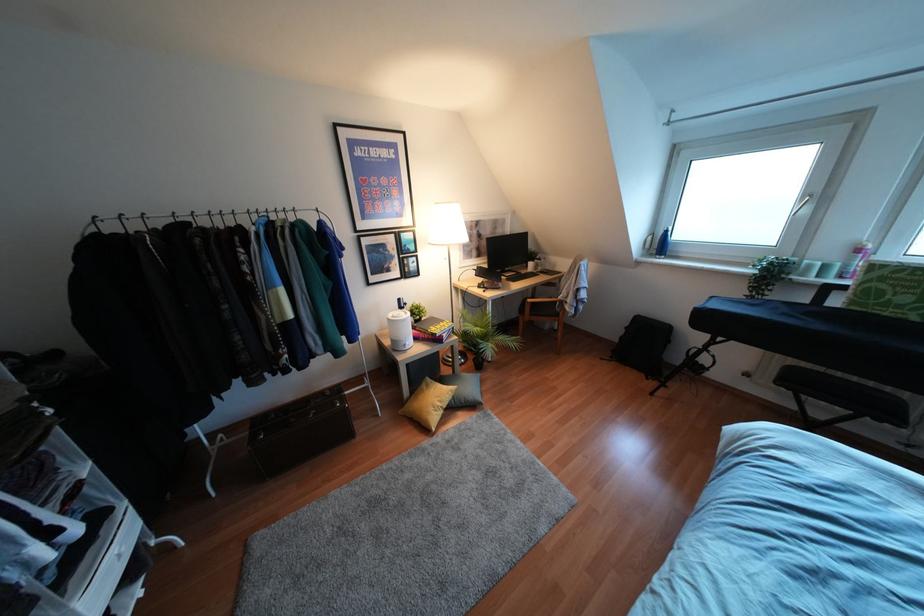
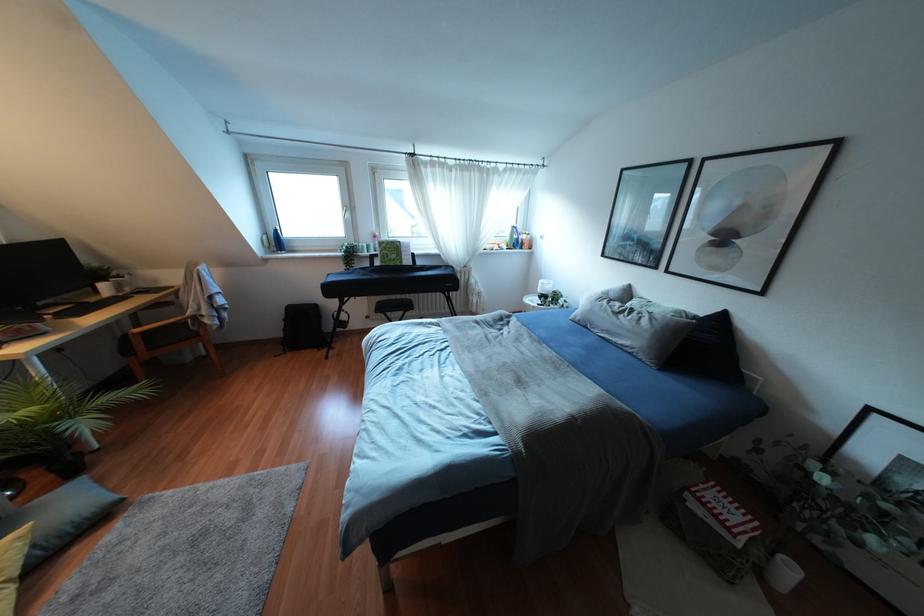
Locate, in the second image, the point that corresponds to pixel 881 292 in the first image.

(385, 254)